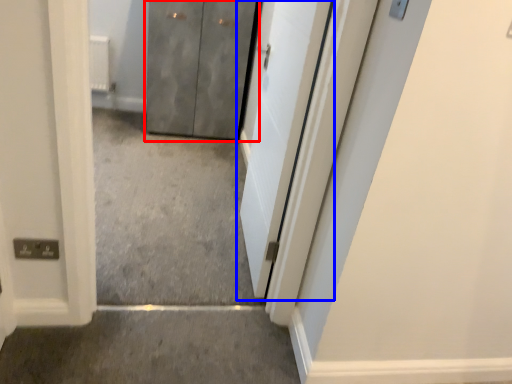
Question: Which object is closer to the camera taking this photo, door (highlighted by a red box) or door (highlighted by a blue box)?

Choices:
 (A) door
 (B) door

Answer: (B)